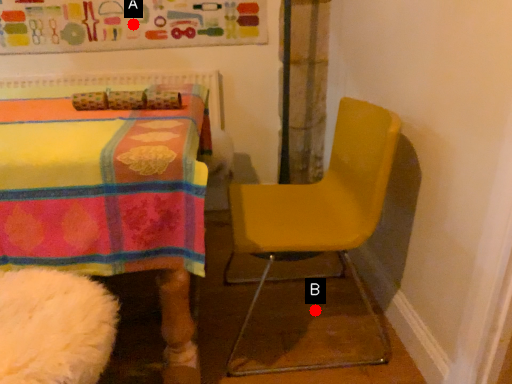
Question: Two points are circled on the image, labeled by A and B beside each circle. Which point is closer to the camera?

Choices:
 (A) A is closer
 (B) B is closer

Answer: (B)